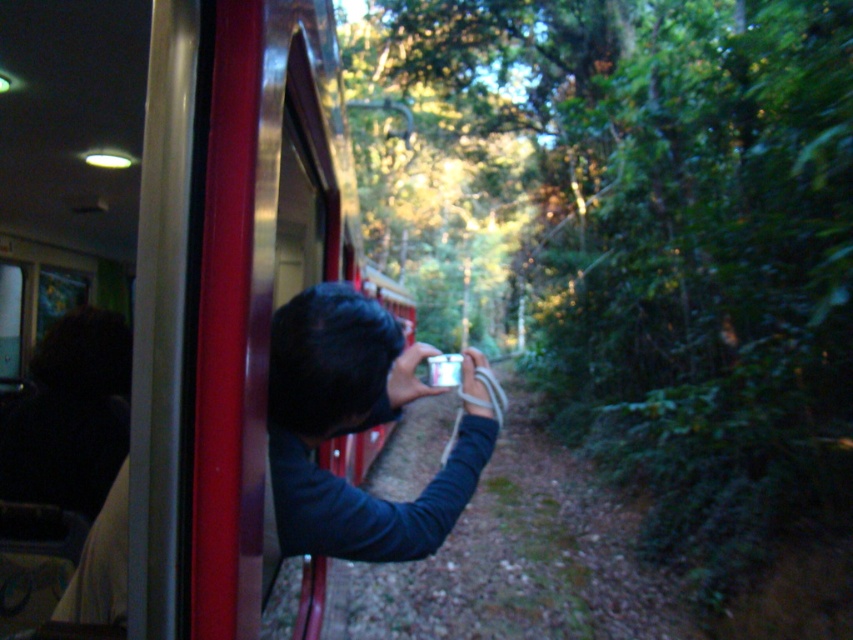
Question: Does metallic red train at left lie in front of metallic silver camera at center?

Choices:
 (A) yes
 (B) no

Answer: (B)

Question: Can you confirm if metallic red train at left is thinner than metallic silver camera at center?

Choices:
 (A) yes
 (B) no

Answer: (B)

Question: Which point is closer to the camera taking this photo?

Choices:
 (A) (289, 365)
 (B) (341, 161)

Answer: (A)

Question: Which object appears closest to the camera in this image?

Choices:
 (A) metallic silver camera at center
 (B) metallic red train at left

Answer: (A)

Question: Does metallic red train at left appear on the left side of metallic silver camera at center?

Choices:
 (A) yes
 (B) no

Answer: (A)